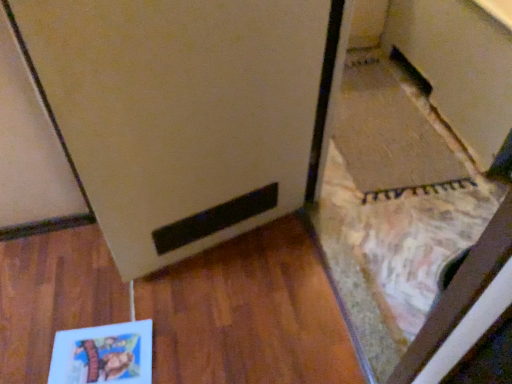
Identify the location of free point behind matte paper book at lower left. (111, 281).